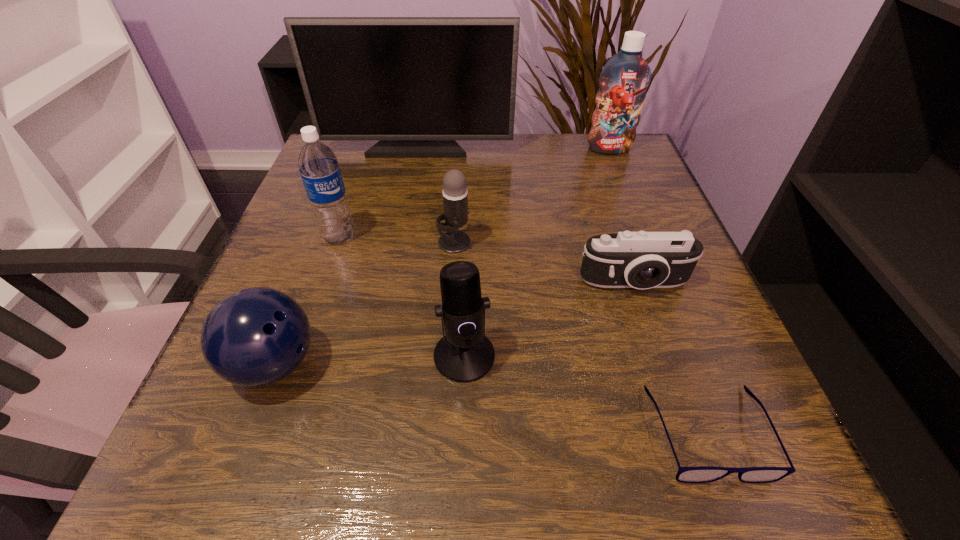
Locate an element on the screen. The height and width of the screenshot is (540, 960). vacant space at the left edge of the desktop is located at coordinates (326, 278).

This screenshot has width=960, height=540. In the image, there is a desktop. Identify the location of vacant space at the right edge. (739, 422).

Identify the location of vacant space at the far left corner. (352, 164).

The image size is (960, 540). In order to click on vacant region at the near left corner of the desktop in this screenshot , I will do `click(285, 470)`.

In the image, there is a desktop. At what (x,y) coordinates should I click in order to perform the action: click on blank space at the far right corner. Please return your answer as a coordinate pair (x, y). This screenshot has width=960, height=540. Looking at the image, I should click on (598, 181).

Where is `free spot between the sixth tallest object and the monitor`? The width and height of the screenshot is (960, 540). free spot between the sixth tallest object and the monitor is located at coordinates (346, 256).

At what (x,y) coordinates should I click in order to perform the action: click on free space between the spectacles and the sixth tallest object. Please return your answer as a coordinate pair (x, y). This screenshot has width=960, height=540. Looking at the image, I should click on (492, 399).

Find the location of a particular element. The height and width of the screenshot is (540, 960). vacant area between the nearer microphone and the camera is located at coordinates (549, 320).

The height and width of the screenshot is (540, 960). Identify the location of free space between the shortest object and the water bottle. (523, 334).

The width and height of the screenshot is (960, 540). In order to click on blank region between the farther microphone and the sixth shortest object in this screenshot , I will do `click(396, 239)`.